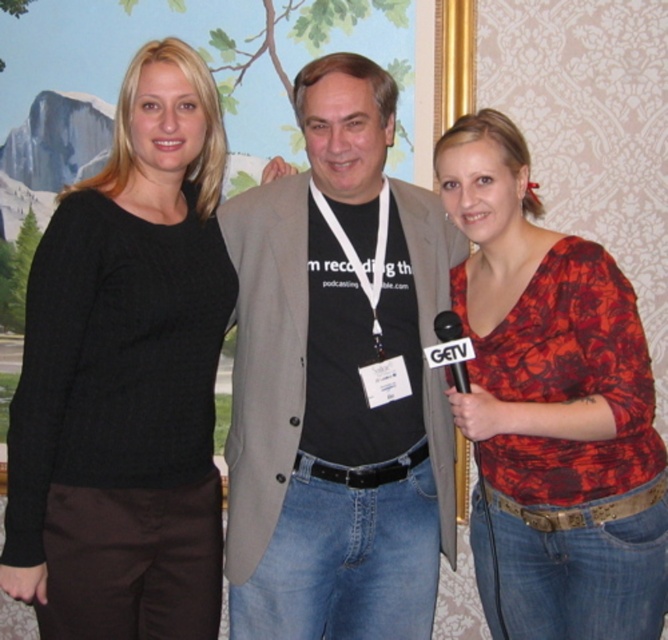
Who is lower down, black cotton t-shirt at center or floral print shirt at center?

floral print shirt at center is below.

Describe the element at coordinates (335, 385) in the screenshot. I see `black cotton t-shirt at center` at that location.

Where is `black cotton t-shirt at center`? This screenshot has width=668, height=640. black cotton t-shirt at center is located at coordinates (335, 385).

Is point (84, 538) closer to camera compared to point (279, 516)?

Yes, point (84, 538) is closer to viewer.

This screenshot has height=640, width=668. What do you see at coordinates (126, 376) in the screenshot?
I see `black sweater at left` at bounding box center [126, 376].

The height and width of the screenshot is (640, 668). Identify the location of black sweater at left. (126, 376).

Who is positioned more to the left, black sweater at left or floral print shirt at center?

black sweater at left is more to the left.

This screenshot has height=640, width=668. I want to click on black sweater at left, so click(x=126, y=376).